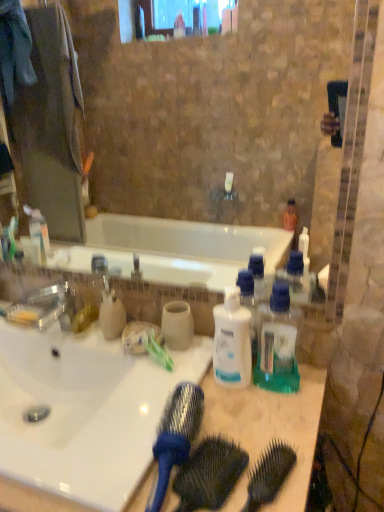
You are a GUI agent. You are given a task and a screenshot of the screen. Output one action in this format:
    pyautogui.click(x=<x>, y=<y>)
    Task: Click on the vacant space in between blue plastic brush at center, which is the 2th brush in right-to-left order, and white plastic bottle at center, the 2th bottle from the right
    
    Given the screenshot: What is the action you would take?
    pyautogui.click(x=222, y=408)